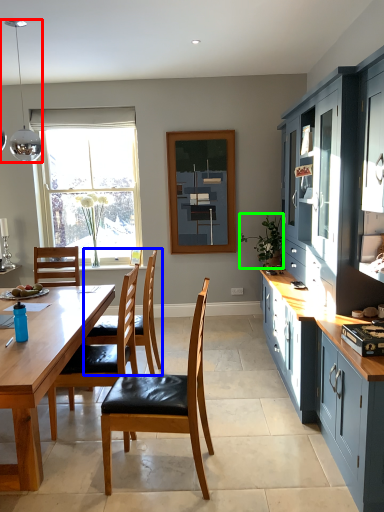
Question: Estimate the real-world distances between objects in this image. Which object is farther from lamp (highlighted by a red box), chair (highlighted by a blue box) or houseplant (highlighted by a green box)?

Choices:
 (A) chair
 (B) houseplant

Answer: (B)